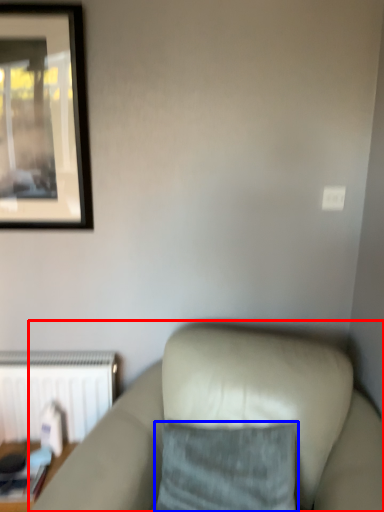
Question: Which point is further to the camera, studio couch (highlighted by a red box) or pillow (highlighted by a blue box)?

Choices:
 (A) studio couch
 (B) pillow

Answer: (B)